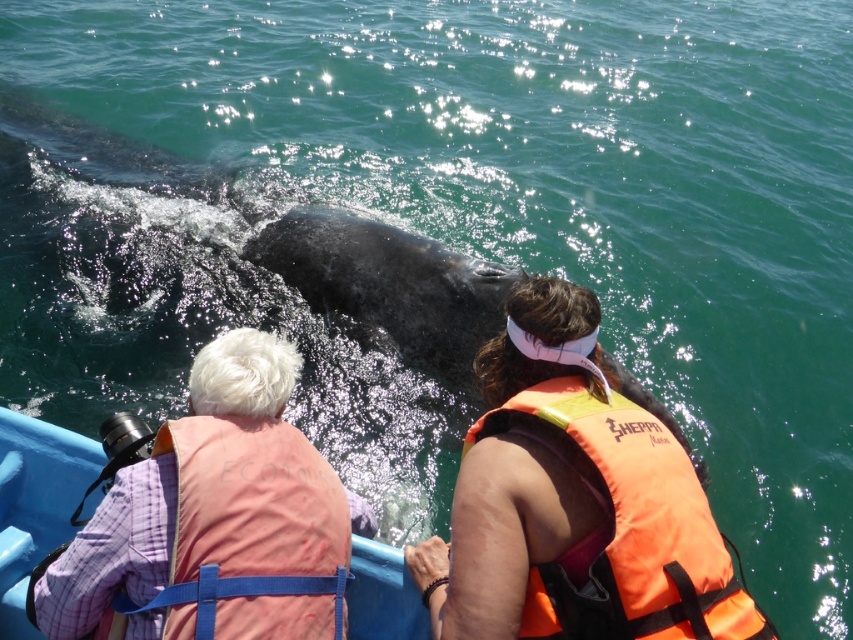
Question: Does pink fabric life vest at left lie behind orange fabric life jacket at center?

Choices:
 (A) no
 (B) yes

Answer: (A)

Question: Which object is positioned closest to the pink fabric life vest at left?

Choices:
 (A) orange fabric life jacket at center
 (B) pink fabric life jacket at upper left

Answer: (B)

Question: Which object is the closest to the pink fabric life jacket at upper left?

Choices:
 (A) pink fabric life vest at left
 (B) orange fabric life jacket at center

Answer: (A)

Question: Does orange fabric life jacket at center appear over pink fabric life jacket at upper left?

Choices:
 (A) yes
 (B) no

Answer: (A)

Question: Which point is closer to the camera?

Choices:
 (A) orange fabric life jacket at center
 (B) pink fabric life jacket at upper left
 (C) pink fabric life vest at left

Answer: (B)

Question: From the image, what is the correct spatial relationship of orange fabric life jacket at center in relation to pink fabric life jacket at upper left?

Choices:
 (A) above
 (B) below

Answer: (A)